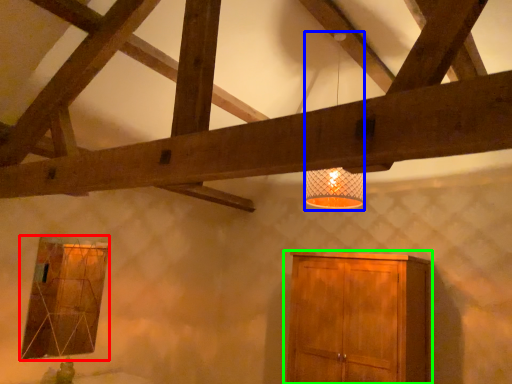
Question: Estimate the real-world distances between objects in this image. Which object is closer to window (highlighted by a red box), lamp (highlighted by a blue box) or cupboard (highlighted by a green box)?

Choices:
 (A) lamp
 (B) cupboard

Answer: (B)